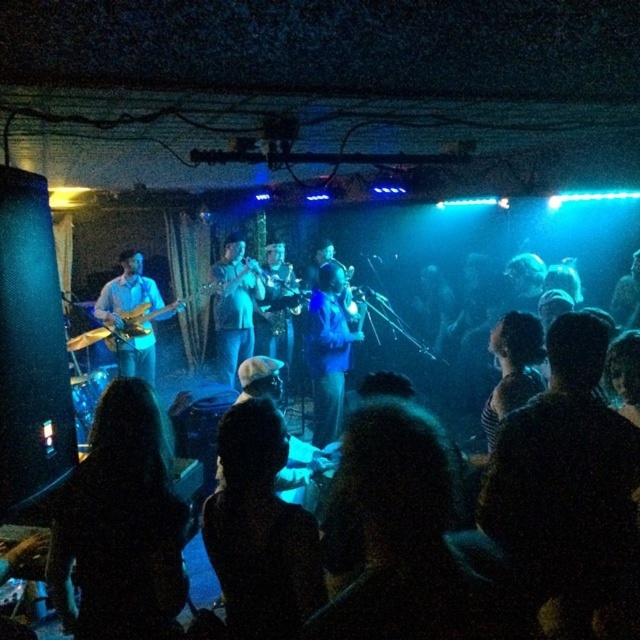
Question: Considering the relative positions of black hair at lower left and black matte head at center in the image provided, where is black hair at lower left located with respect to black matte head at center?

Choices:
 (A) right
 (B) left

Answer: (B)

Question: Which of the following is the closest to the observer?

Choices:
 (A) black hair at lower left
 (B) matte wood guitar at left

Answer: (A)

Question: Which of the following is the farthest from the observer?

Choices:
 (A) (227, 236)
 (B) (96, 637)
 (C) (248, 515)

Answer: (A)

Question: Does black hair at lower left lie in front of matte blue shirt at center?

Choices:
 (A) yes
 (B) no

Answer: (A)

Question: Which of the following is the closest to the observer?

Choices:
 (A) (224, 300)
 (B) (74, 637)

Answer: (B)

Question: Does black hair at lower left appear over matte wood guitar at left?

Choices:
 (A) yes
 (B) no

Answer: (B)